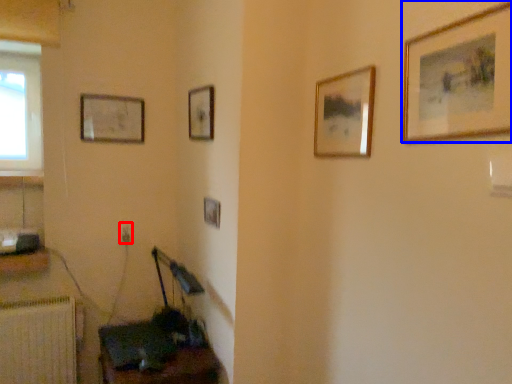
Question: Which point is closer to the camera, electric outlet (highlighted by a red box) or picture frame (highlighted by a blue box)?

Choices:
 (A) electric outlet
 (B) picture frame

Answer: (B)